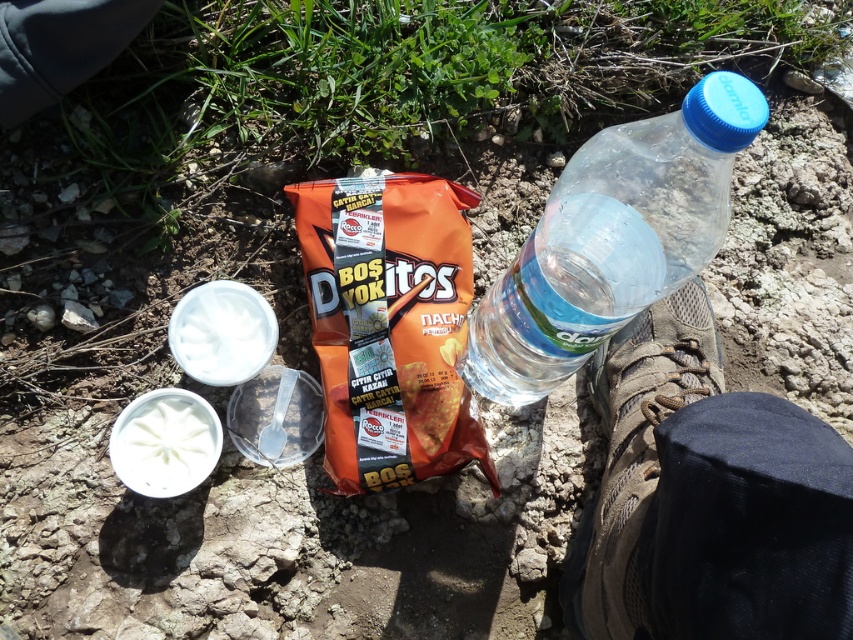
You are planning to place a small napkin between the orange matte doritos at center and the transparent plastic bottle at right. Based on their current positions, which object should the napkin be placed closer to the left of?

The napkin should be placed closer to the left of the orange matte doritos at center because it is positioned on the left side of the transparent plastic bottle at right.

You are standing at the origin point in the image. There is a point located at coordinates point (390, 326). What object is this point located on?

The point (390, 326) is located on the orange matte doritos at center.